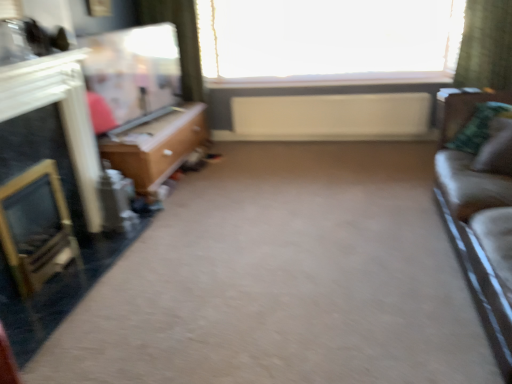
The height and width of the screenshot is (384, 512). Identify the location of vacant space in front of white matte radiator at center. (311, 168).